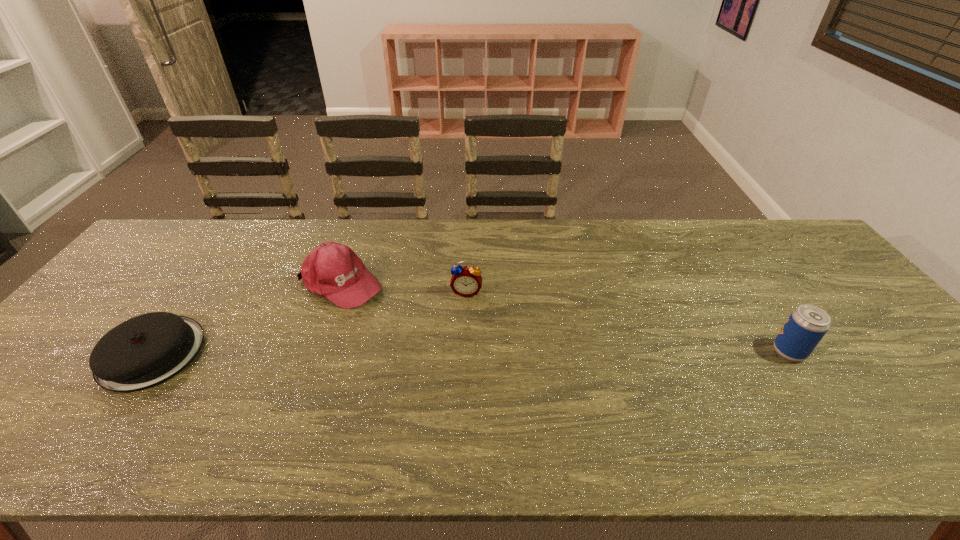
The width and height of the screenshot is (960, 540). What are the coordinates of `vacant region located at the front of the baseball cap with the brim` in the screenshot? It's located at click(x=454, y=346).

What are the coordinates of `free region located at the front of the baseball cap with the brim` in the screenshot? It's located at (405, 318).

Where is `free space located at the front of the baseball cap with the brim`? The image size is (960, 540). free space located at the front of the baseball cap with the brim is located at coordinates (424, 329).

The image size is (960, 540). What are the coordinates of `object situated at the far edge` in the screenshot? It's located at (332, 270).

Where is `object at the near edge`? The width and height of the screenshot is (960, 540). object at the near edge is located at coordinates (144, 351).

Locate an element on the screen. The width and height of the screenshot is (960, 540). object that is at the left edge is located at coordinates (144, 351).

The width and height of the screenshot is (960, 540). In order to click on object situated at the near left corner in this screenshot , I will do `click(144, 351)`.

What are the coordinates of `vacant space at the far edge` in the screenshot? It's located at (369, 244).

I want to click on blank space at the left edge of the desktop, so click(x=73, y=382).

You are a GUI agent. You are given a task and a screenshot of the screen. Output one action in this format:
    pyautogui.click(x=<x>, y=<y>)
    Task: Click on the free space at the right edge of the desktop
    This screenshot has height=540, width=960.
    Given the screenshot: What is the action you would take?
    pyautogui.click(x=821, y=269)